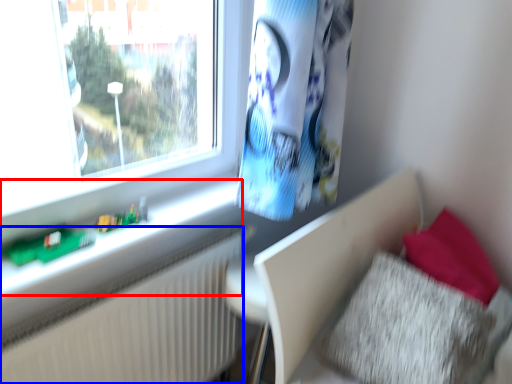
Question: Which object is closer to the camera taking this photo, window sill (highlighted by a red box) or radiator (highlighted by a blue box)?

Choices:
 (A) window sill
 (B) radiator

Answer: (A)